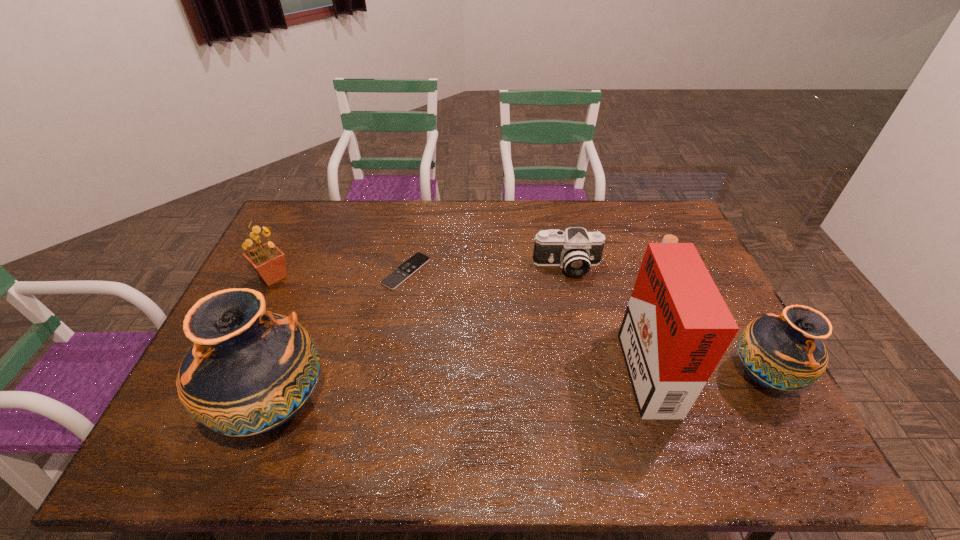
The image size is (960, 540). In order to click on object located in the near left corner section of the desktop in this screenshot , I will do `click(249, 371)`.

Find the location of `object present at the near right corner`. object present at the near right corner is located at coordinates click(785, 352).

This screenshot has width=960, height=540. In the image, there is a desktop. Identify the location of blank space at the far edge. (351, 235).

Locate an element on the screen. vacant region at the near edge of the desktop is located at coordinates (416, 411).

You are a GUI agent. You are given a task and a screenshot of the screen. Output one action in this format:
    pyautogui.click(x=<x>, y=<y>)
    Task: Click on the free space at the left edge of the desktop
    The width and height of the screenshot is (960, 540).
    Given the screenshot: What is the action you would take?
    pyautogui.click(x=296, y=258)

Locate an element on the screen. vacant region at the far left corner is located at coordinates (301, 219).

Find the location of `vacant space at the far right corner of the desktop`. vacant space at the far right corner of the desktop is located at coordinates (673, 213).

Locate an element on the screen. free space between the shortest object and the shorter pottery is located at coordinates (585, 323).

Where is `free space between the sunflower and the shorter pottery`? This screenshot has width=960, height=540. free space between the sunflower and the shorter pottery is located at coordinates (518, 326).

This screenshot has height=540, width=960. Find the location of `free point between the left pottery and the cigarette case`. free point between the left pottery and the cigarette case is located at coordinates (460, 386).